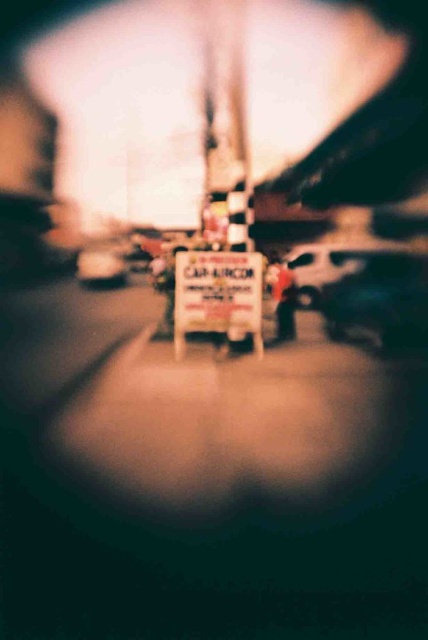
Question: Considering the real-world distances, which object is closest to the yellow paper sign at center?

Choices:
 (A) metallic silver car at center
 (B) metallic silver van at center

Answer: (B)

Question: Considering the real-world distances, which object is closest to the metallic silver car at center?

Choices:
 (A) shiny black car at center
 (B) metallic silver van at center
 (C) yellow paper sign at center

Answer: (C)

Question: Does metallic silver van at center have a greater width compared to metallic silver car at center?

Choices:
 (A) no
 (B) yes

Answer: (B)

Question: Which point is closer to the camera taking this photo?

Choices:
 (A) (344, 248)
 (B) (100, 262)

Answer: (A)

Question: Is shiny black car at center to the left of metallic silver van at center from the viewer's perspective?

Choices:
 (A) yes
 (B) no

Answer: (B)

Question: Is yellow paper sign at center to the left of metallic silver van at center from the viewer's perspective?

Choices:
 (A) yes
 (B) no

Answer: (A)